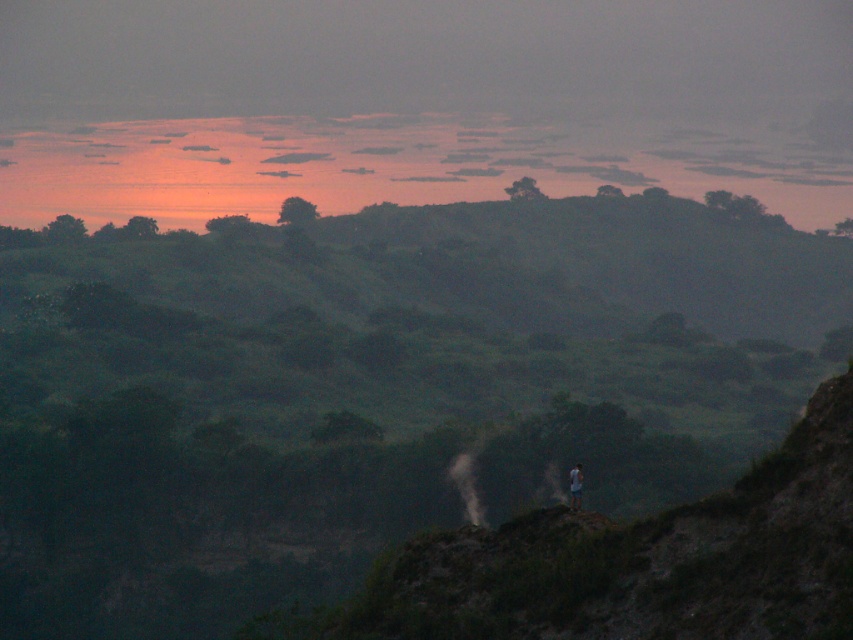
Question: Which object is closer to the camera taking this photo?

Choices:
 (A) blue denim shorts at center
 (B) green grassy hill at center

Answer: (A)

Question: Is green grassy hill at center bigger than blue denim shorts at center?

Choices:
 (A) yes
 (B) no

Answer: (A)

Question: Which point appears closest to the camera in this image?

Choices:
 (A) (7, 417)
 (B) (579, 483)

Answer: (B)

Question: Does green grassy hill at center have a greater width compared to blue denim shorts at center?

Choices:
 (A) no
 (B) yes

Answer: (B)

Question: Can you confirm if green grassy hill at center is thinner than blue denim shorts at center?

Choices:
 (A) no
 (B) yes

Answer: (A)